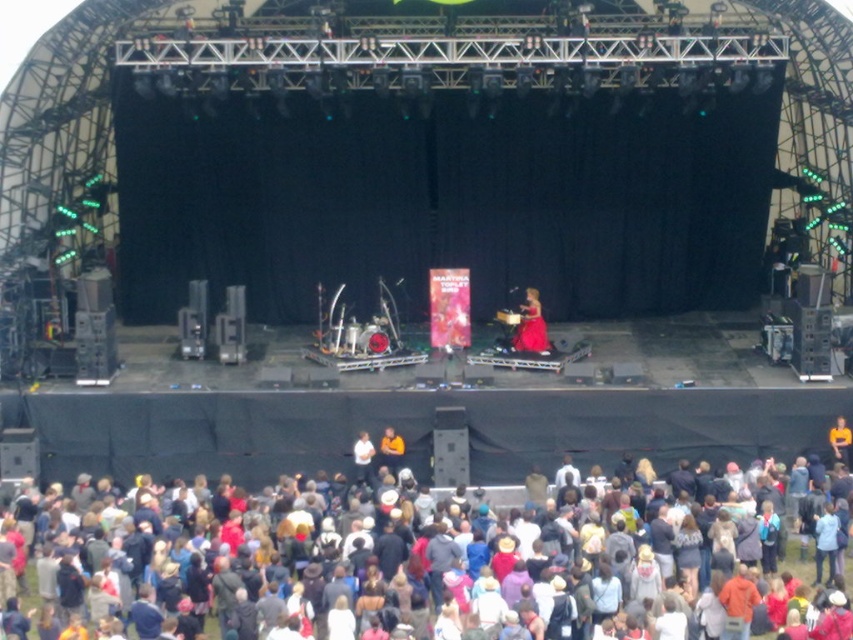
You are a photographer at the concert. You want to take a photo of the matte pink dress at center so it appears to the right of the multicolored fabric crowd at lower center in the image. Is this possible based on their current positions?

Yes, because the multicolored fabric crowd at lower center is already positioned to the left of the matte pink dress at center, so the dress will naturally appear to the right of the crowd in the photo.

You are at the outdoor concert and want to take a photo of the stage. You notice two points on the stage marked as point 1 and point 2. If point 1 is at coordinates point (x=346, y=612) and point 2 is at point (x=543, y=332), which point will appear larger in your photo?

Point 1 at coordinates point (x=346, y=612) will appear larger in the photo because it is closer to the viewer than point 2 at point (x=543, y=332).

You are a photographer at the concert and want to capture a photo of the matte pink dress at center without the multicolored fabric crowd at lower center blocking it. Can you adjust your camera angle to achieve this?

The multicolored fabric crowd at lower center is wider than the matte pink dress at center, so adjusting the camera angle might help avoid the crowd blocking the dress if the dress is positioned higher or further back than the crowd.